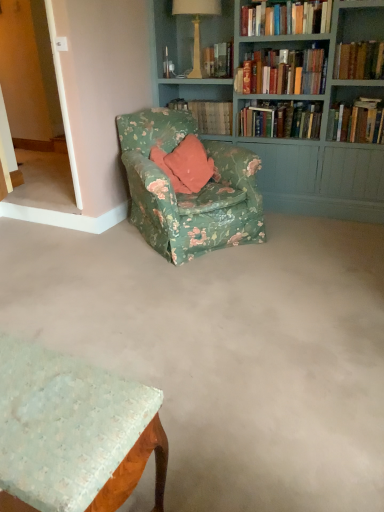
At what (x,y) coordinates should I click in order to perform the action: click on floral fabric armchair at center. Please return your answer as a coordinate pair (x, y). Looking at the image, I should click on (191, 194).

Describe the element at coordinates (191, 194) in the screenshot. I see `floral fabric armchair at center` at that location.

Describe the element at coordinates (286, 99) in the screenshot. I see `teal painted wood bookcase at upper right` at that location.

This screenshot has width=384, height=512. Describe the element at coordinates (73, 432) in the screenshot. I see `floral fabric table at lower left` at that location.

Identify the location of hardcover books at upper right, which is the fourth book in right-to-left order. (286, 18).

The height and width of the screenshot is (512, 384). Describe the element at coordinates (286, 18) in the screenshot. I see `hardcover books at upper right, which ranks as the third book in left-to-right order` at that location.

Measure the distance between point (x=279, y=105) and camera.

They are 3.24 meters apart.

Where is `hardcover books at upper right, which is the first book from right to left`? hardcover books at upper right, which is the first book from right to left is located at coordinates (357, 121).

I want to click on floral fabric armchair at center, so click(x=191, y=194).

Are floral fabric armchair at center and hardcover book at upper right, which is the fifth book from left to right, far apart?

floral fabric armchair at center is far away from hardcover book at upper right, which is the fifth book from left to right.

Considering the sizes of floral fabric armchair at center and hardcover book at upper right, which is the fifth book from left to right, in the image, is floral fabric armchair at center wider or thinner than hardcover book at upper right, which is the fifth book from left to right,?

In the image, floral fabric armchair at center appears to be wider than hardcover book at upper right, which is the fifth book from left to right.

Is floral fabric armchair at center oriented away from hardcover book at upper right, which is the fifth book from left to right?

floral fabric armchair at center does not have its back to hardcover book at upper right, which is the fifth book from left to right.

Between floral fabric armchair at center and hardcover book at upper right, which is the second book in right-to-left order, which one has smaller size?

With smaller size is hardcover book at upper right, which is the second book in right-to-left order.

Can you confirm if floral fabric book at center, which is the sixth book from right to left, is positioned to the right of matte cream lamp at upper center?

Yes, floral fabric book at center, which is the sixth book from right to left, is to the right of matte cream lamp at upper center.

Is matte cream lamp at upper center completely or partially inside floral fabric book at center, which is the first book in left-to-right order?

No, matte cream lamp at upper center is not a part of floral fabric book at center, which is the first book in left-to-right order.

From a real-world perspective, is floral fabric book at center, which is the sixth book from right to left, located beneath matte cream lamp at upper center?

Yes, from a real-world perspective, floral fabric book at center, which is the sixth book from right to left, is beneath matte cream lamp at upper center.

Is hardcover books at upper right, the 6th book in the left-to-right sequence, completely or partially inside hardcover books at upper right, which is counted as the third book, starting from the right?

Actually, hardcover books at upper right, the 6th book in the left-to-right sequence, is outside hardcover books at upper right, which is counted as the third book, starting from the right.

Which is behind, hardcover books at upper right, arranged as the fourth book when viewed from the left, or hardcover books at upper right, which is the first book from right to left?

Positioned behind is hardcover books at upper right, arranged as the fourth book when viewed from the left.

Considering the sizes of hardcover books at upper right, which is counted as the third book, starting from the right, and hardcover books at upper right, which is the first book from right to left, in the image, is hardcover books at upper right, which is counted as the third book, starting from the right, wider or thinner than hardcover books at upper right, which is the first book from right to left,?

Considering their sizes, hardcover books at upper right, which is counted as the third book, starting from the right, looks slimmer than hardcover books at upper right, which is the first book from right to left.

Which is nearer, (x=263, y=119) or (x=374, y=136)?

The point (x=374, y=136) is closer to the camera.

Which point is more distant from viewer, (x=269, y=51) or (x=159, y=67)?

The point (x=159, y=67) is farther from the camera.

Between hardcover books at upper center, the second book from the left, and matte cream lamp at upper center, which one appears on the right side from the viewer's perspective?

hardcover books at upper center, the second book from the left, is more to the right.

From the picture: Is hardcover books at upper center, positioned as the fifth book in right-to-left order, touching matte cream lamp at upper center?

No, hardcover books at upper center, positioned as the fifth book in right-to-left order, is not next to matte cream lamp at upper center.

Image resolution: width=384 pixels, height=512 pixels. Find the location of `chair that appears on the left of hardcover book at upper right, which is the second book in right-to-left order`. chair that appears on the left of hardcover book at upper right, which is the second book in right-to-left order is located at coordinates (191, 194).

Does hardcover book at upper right, which is the second book in right-to-left order, appear on the left side of floral fabric armchair at center?

No, hardcover book at upper right, which is the second book in right-to-left order, is not to the left of floral fabric armchair at center.

Does point (371, 48) lie behind point (233, 192)?

No, (371, 48) is in front of (233, 192).

In the image, is hardcover books at upper right, the 6th book in the left-to-right sequence, on the left side or the right side of hardcover book at upper right, which is the fifth book from left to right?

hardcover books at upper right, the 6th book in the left-to-right sequence, is to the right of hardcover book at upper right, which is the fifth book from left to right.

From a real-world perspective, which is physically below, hardcover books at upper right, which is the first book from right to left, or hardcover book at upper right, which is the fifth book from left to right?

hardcover books at upper right, which is the first book from right to left, from a real-world perspective.

Based on the photo, is hardcover books at upper right, which is the first book from right to left, touching hardcover book at upper right, which is the fifth book from left to right?

hardcover books at upper right, which is the first book from right to left, is not next to hardcover book at upper right, which is the fifth book from left to right, and they're not touching.

Does hardcover books at upper right, which is the first book from right to left, have a lesser width compared to hardcover book at upper right, which is the fifth book from left to right?

In fact, hardcover books at upper right, which is the first book from right to left, might be wider than hardcover book at upper right, which is the fifth book from left to right.

From a real-world perspective, is hardcover books at upper center, positioned as the fifth book in right-to-left order, on hardcover books at upper right, which is counted as the third book, starting from the right?

Indeed, from a real-world perspective, hardcover books at upper center, positioned as the fifth book in right-to-left order, stands above hardcover books at upper right, which is counted as the third book, starting from the right.

Is hardcover books at upper center, the second book from the left, further to the viewer compared to hardcover books at upper right, arranged as the fourth book when viewed from the left?

No, it is in front of hardcover books at upper right, arranged as the fourth book when viewed from the left.

You are a GUI agent. You are given a task and a screenshot of the screen. Output one action in this format:
    pyautogui.click(x=<x>, y=<y>)
    Task: Click on the book that is the 2nd one when counting downward from the hardcover books at upper center, the second book from the left (from the image's perspective)
    The image size is (384, 512).
    Given the screenshot: What is the action you would take?
    pyautogui.click(x=281, y=120)

Can you confirm if hardcover books at upper center, positioned as the fifth book in right-to-left order, is positioned to the left of hardcover books at upper right, arranged as the fourth book when viewed from the left?

Correct, you'll find hardcover books at upper center, positioned as the fifth book in right-to-left order, to the left of hardcover books at upper right, arranged as the fourth book when viewed from the left.

Starting from the floral fabric armchair at center, which book is the 5th one to the right? Please provide its 2D coordinates.

[(359, 60)]

Locate an element on the screen. This screenshot has width=384, height=512. book that is the 5th object directly below the matte cream lamp at upper center (from a real-world perspective) is located at coordinates (207, 115).

Based on the photo, when comparing their distances from hardcover books at upper right, which ranks as the third book in left-to-right order, does hardcover books at upper right, the 6th book in the left-to-right sequence, or floral fabric armchair at center seem closer?

hardcover books at upper right, the 6th book in the left-to-right sequence.

Which object lies nearer to the anchor point hardcover books at upper center, the second book from the left, hardcover book at upper right, which is the second book in right-to-left order, or floral fabric armchair at center?

Among the two, hardcover book at upper right, which is the second book in right-to-left order, is located nearer to hardcover books at upper center, the second book from the left.

Estimate the real-world distances between objects in this image. Which object is further from hardcover books at upper center, positioned as the fifth book in right-to-left order, hardcover books at upper right, which ranks as the third book in left-to-right order, or hardcover book at upper right, which is the second book in right-to-left order?

hardcover book at upper right, which is the second book in right-to-left order, is positioned further to the anchor hardcover books at upper center, positioned as the fifth book in right-to-left order.

From the picture: Estimate the real-world distances between objects in this image. Which object is closer to teal painted wood bookcase at upper right, hardcover books at upper center, positioned as the fifth book in right-to-left order, or hardcover book at upper right, which is the second book in right-to-left order?

hardcover books at upper center, positioned as the fifth book in right-to-left order, lies closer to teal painted wood bookcase at upper right than the other object.

From the image, which object appears to be nearer to hardcover book at upper right, which is the fifth book from left to right, teal painted wood bookcase at upper right or hardcover books at upper center, positioned as the fifth book in right-to-left order?

Based on the image, hardcover books at upper center, positioned as the fifth book in right-to-left order, appears to be nearer to hardcover book at upper right, which is the fifth book from left to right.

In the scene shown: Which object lies nearer to the anchor point matte cream lamp at upper center, teal painted wood bookcase at upper right or hardcover books at upper center, positioned as the fifth book in right-to-left order?

teal painted wood bookcase at upper right.

Which object lies further to the anchor point hardcover books at upper right, which is counted as the third book, starting from the right, hardcover books at upper right, the 6th book in the left-to-right sequence, or teal painted wood bookcase at upper right?

A: hardcover books at upper right, the 6th book in the left-to-right sequence, is further to hardcover books at upper right, which is counted as the third book, starting from the right.

When comparing their distances from hardcover books at upper right, which is the fourth book in right-to-left order, does floral fabric armchair at center or hardcover books at upper right, arranged as the fourth book when viewed from the left, seem closer?

hardcover books at upper right, arranged as the fourth book when viewed from the left, lies closer to hardcover books at upper right, which is the fourth book in right-to-left order, than the other object.

The image size is (384, 512). Find the location of `bookcase located between matte cream lamp at upper center and hardcover books at upper right, which is counted as the third book, starting from the right, in the left-right direction`. bookcase located between matte cream lamp at upper center and hardcover books at upper right, which is counted as the third book, starting from the right, in the left-right direction is located at coordinates (286, 99).

The image size is (384, 512). Identify the location of bookcase between floral fabric armchair at center and floral fabric book at center, which is the sixth book from right to left, from front to back. (286, 99).

Locate an element on the screen. chair between floral fabric table at lower left and teal painted wood bookcase at upper right in the front-back direction is located at coordinates (191, 194).

Locate an element on the screen. The height and width of the screenshot is (512, 384). bookcase that lies between hardcover books at upper center, the second book from the left, and floral fabric armchair at center from top to bottom is located at coordinates (286, 99).